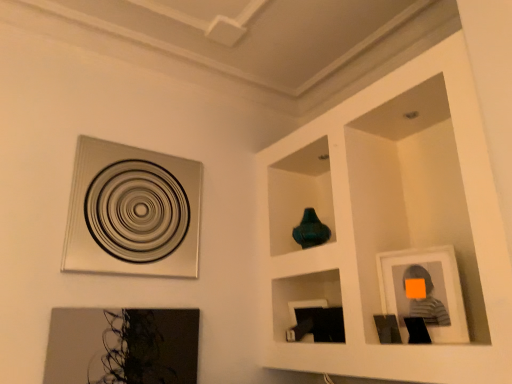
Question: Is matte gray picture frame at right, the first picture frame when ordered from right to left, closer to the viewer compared to matte black picture frame at lower left, the 2th picture frame in the left-to-right sequence?

Choices:
 (A) yes
 (B) no

Answer: (A)

Question: Is matte gray picture frame at right, which is the 3th picture frame in left-to-right order, bigger than matte black picture frame at lower left, the 2th picture frame in the left-to-right sequence?

Choices:
 (A) yes
 (B) no

Answer: (B)

Question: Is matte gray picture frame at right, the first picture frame when ordered from right to left, beside matte black picture frame at lower left, the 2th picture frame in the left-to-right sequence?

Choices:
 (A) no
 (B) yes

Answer: (A)

Question: Is matte gray picture frame at right, which is the 3th picture frame in left-to-right order, smaller than matte black picture frame at lower left, the 2th picture frame in the right-to-left sequence?

Choices:
 (A) yes
 (B) no

Answer: (A)

Question: Considering the relative sizes of matte gray picture frame at right, which is the 3th picture frame in left-to-right order, and matte black picture frame at lower left, the 2th picture frame in the left-to-right sequence, in the image provided, is matte gray picture frame at right, which is the 3th picture frame in left-to-right order, taller than matte black picture frame at lower left, the 2th picture frame in the left-to-right sequence,?

Choices:
 (A) yes
 (B) no

Answer: (A)

Question: From a real-world perspective, does matte gray picture frame at right, which is the 3th picture frame in left-to-right order, sit lower than matte black picture frame at lower left, the 2th picture frame in the right-to-left sequence?

Choices:
 (A) no
 (B) yes

Answer: (A)

Question: Is matte black picture frame at lower left, the 2th picture frame in the left-to-right sequence, oriented away from metallic silver picture frame at upper left, acting as the third picture frame starting from the right?

Choices:
 (A) no
 (B) yes

Answer: (A)

Question: Is matte black picture frame at lower left, the 2th picture frame in the right-to-left sequence, to the right of metallic silver picture frame at upper left, the first picture frame in the left-to-right sequence, from the viewer's perspective?

Choices:
 (A) yes
 (B) no

Answer: (A)

Question: Is metallic silver picture frame at upper left, the first picture frame in the left-to-right sequence, located within matte black picture frame at lower left, the 2th picture frame in the right-to-left sequence?

Choices:
 (A) yes
 (B) no

Answer: (B)

Question: From a real-world perspective, is matte black picture frame at lower left, the 2th picture frame in the left-to-right sequence, under metallic silver picture frame at upper left, acting as the third picture frame starting from the right?

Choices:
 (A) yes
 (B) no

Answer: (A)

Question: From a real-world perspective, is matte black picture frame at lower left, the 2th picture frame in the left-to-right sequence, on top of metallic silver picture frame at upper left, the first picture frame in the left-to-right sequence?

Choices:
 (A) yes
 (B) no

Answer: (B)

Question: Is matte black picture frame at lower left, the 2th picture frame in the left-to-right sequence, shorter than metallic silver picture frame at upper left, acting as the third picture frame starting from the right?

Choices:
 (A) yes
 (B) no

Answer: (A)

Question: Is metallic silver picture frame at upper left, acting as the third picture frame starting from the right, far from matte gray picture frame at right, the first picture frame when ordered from right to left?

Choices:
 (A) yes
 (B) no

Answer: (A)